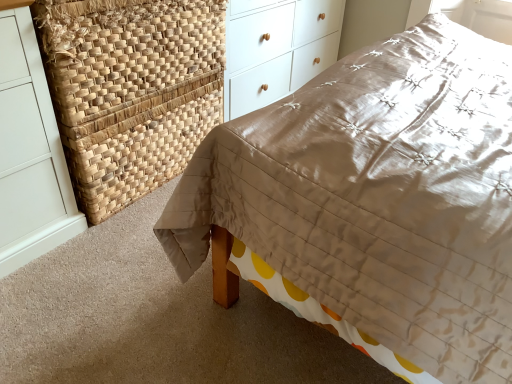
Question: Can you confirm if matte brown quilt at center is thinner than natural woven basket at upper left?

Choices:
 (A) yes
 (B) no

Answer: (B)

Question: Is natural woven basket at upper left at the back of matte brown quilt at center?

Choices:
 (A) yes
 (B) no

Answer: (B)

Question: Considering the relative sizes of matte brown quilt at center and natural woven basket at upper left in the image provided, is matte brown quilt at center taller than natural woven basket at upper left?

Choices:
 (A) yes
 (B) no

Answer: (A)

Question: From a real-world perspective, is matte brown quilt at center beneath natural woven basket at upper left?

Choices:
 (A) no
 (B) yes

Answer: (A)

Question: From the image's perspective, is matte brown quilt at center below natural woven basket at upper left?

Choices:
 (A) no
 (B) yes

Answer: (B)

Question: From the image's perspective, is matte brown quilt at center positioned above or below white wood chest of drawers at upper center?

Choices:
 (A) below
 (B) above

Answer: (A)

Question: Is matte brown quilt at center taller or shorter than white wood chest of drawers at upper center?

Choices:
 (A) short
 (B) tall

Answer: (B)

Question: Is point (318, 208) closer or farther from the camera than point (321, 4)?

Choices:
 (A) farther
 (B) closer

Answer: (B)

Question: Based on their positions, is matte brown quilt at center located to the left or right of white wood chest of drawers at upper center?

Choices:
 (A) left
 (B) right

Answer: (B)

Question: Is white wood chest of drawers at upper center taller or shorter than natural woven basket at upper left?

Choices:
 (A) short
 (B) tall

Answer: (B)

Question: From a real-world perspective, relative to natural woven basket at upper left, is white wood chest of drawers at upper center vertically above or below?

Choices:
 (A) below
 (B) above

Answer: (B)

Question: Looking at the image, does white wood chest of drawers at upper center seem bigger or smaller compared to natural woven basket at upper left?

Choices:
 (A) big
 (B) small

Answer: (A)

Question: Is white wood chest of drawers at upper center situated inside natural woven basket at upper left or outside?

Choices:
 (A) inside
 (B) outside

Answer: (B)

Question: Relative to matte brown quilt at center, is white wood chest of drawers at upper center in front or behind?

Choices:
 (A) front
 (B) behind

Answer: (B)

Question: Is point (313, 59) closer or farther from the camera than point (505, 279)?

Choices:
 (A) farther
 (B) closer

Answer: (A)